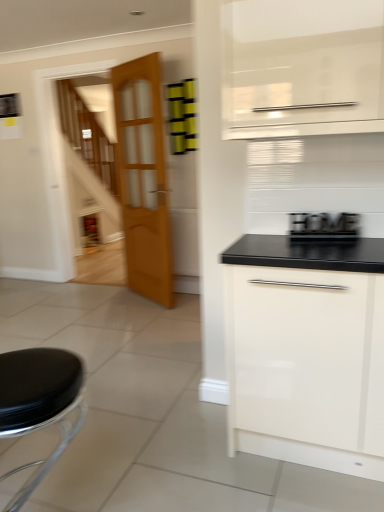
Question: Can you confirm if wooden glass door at center is positioned to the left of white glossy cabinet at lower right?

Choices:
 (A) yes
 (B) no

Answer: (A)

Question: Is wooden glass door at center not inside white glossy cabinet at lower right?

Choices:
 (A) yes
 (B) no

Answer: (A)

Question: Can you confirm if wooden glass door at center is smaller than white glossy cabinet at lower right?

Choices:
 (A) no
 (B) yes

Answer: (B)

Question: Is wooden glass door at center bigger than white glossy cabinet at lower right?

Choices:
 (A) no
 (B) yes

Answer: (A)

Question: Can you confirm if wooden glass door at center is shorter than white glossy cabinet at lower right?

Choices:
 (A) no
 (B) yes

Answer: (A)

Question: From the image's perspective, does wooden glass door at center appear higher than white glossy cabinet at lower right?

Choices:
 (A) no
 (B) yes

Answer: (B)

Question: Is black leather stool at lower left next to wooden glass door at center and touching it?

Choices:
 (A) no
 (B) yes

Answer: (A)

Question: From the image's perspective, is black leather stool at lower left located beneath wooden glass door at center?

Choices:
 (A) yes
 (B) no

Answer: (A)

Question: Would you say black leather stool at lower left is a long distance from wooden glass door at center?

Choices:
 (A) yes
 (B) no

Answer: (A)

Question: Is black leather stool at lower left thinner than wooden glass door at center?

Choices:
 (A) yes
 (B) no

Answer: (B)

Question: Considering the relative positions of black leather stool at lower left and wooden glass door at center in the image provided, is black leather stool at lower left to the left of wooden glass door at center from the viewer's perspective?

Choices:
 (A) no
 (B) yes

Answer: (B)

Question: Considering the relative sizes of black leather stool at lower left and wooden glass door at center in the image provided, is black leather stool at lower left smaller than wooden glass door at center?

Choices:
 (A) no
 (B) yes

Answer: (A)

Question: From a real-world perspective, is black wood sign at right under black leather stool at lower left?

Choices:
 (A) no
 (B) yes

Answer: (A)